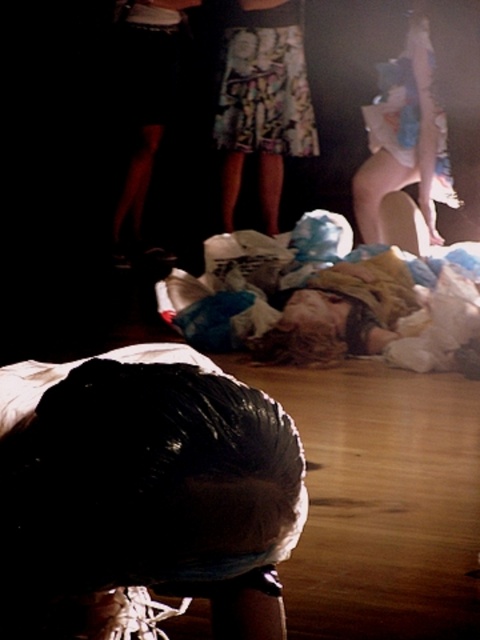
Between black matte hair at lower center and printed fabric skirt at center, which one has less height?

black matte hair at lower center is shorter.

Locate an element on the screen. The width and height of the screenshot is (480, 640). black matte hair at lower center is located at coordinates (143, 492).

Where is `black matte hair at lower center`? The height and width of the screenshot is (640, 480). black matte hair at lower center is located at coordinates (143, 492).